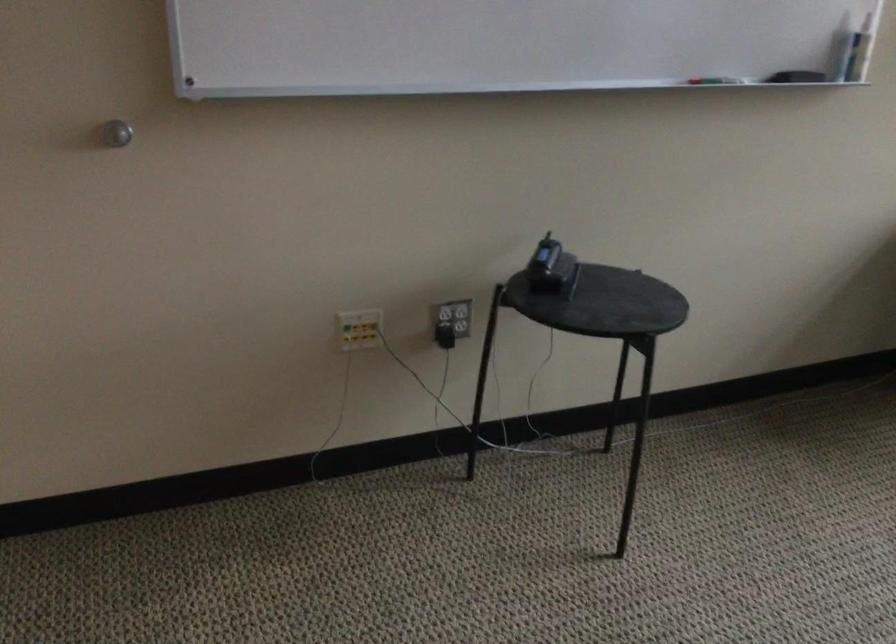
At what (x,y) coordinates should I click in order to perform the action: click on black phone handset. Please return your answer as a coordinate pair (x, y). Image resolution: width=896 pixels, height=644 pixels. Looking at the image, I should click on (550, 268).